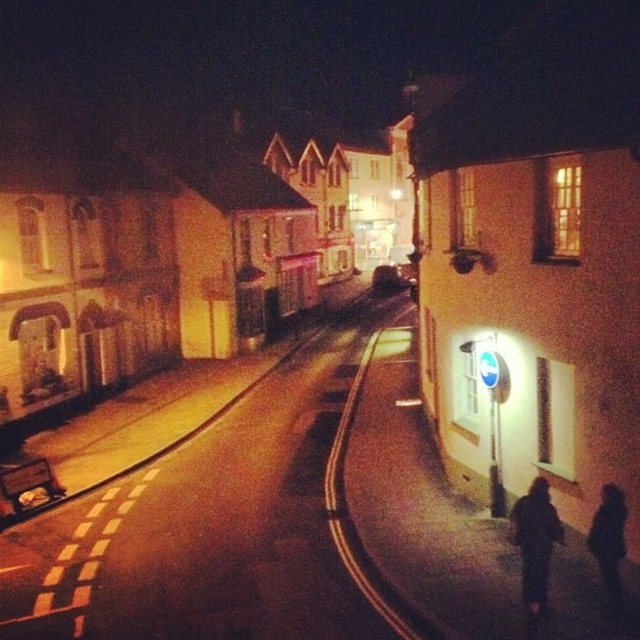
Does black asphalt road at center appear on the left side of black matte figure at lower right?

Indeed, black asphalt road at center is positioned on the left side of black matte figure at lower right.

Is point (32, 624) positioned after point (616, 550)?

Yes, it is behind point (616, 550).

The height and width of the screenshot is (640, 640). I want to click on black asphalt road at center, so click(x=209, y=524).

Image resolution: width=640 pixels, height=640 pixels. I want to click on black asphalt road at center, so click(209, 524).

Does dark fabric jacket at lower right appear over black matte figure at lower right?

No.

Does dark fabric jacket at lower right have a smaller size compared to black matte figure at lower right?

Indeed, dark fabric jacket at lower right has a smaller size compared to black matte figure at lower right.

I want to click on dark fabric jacket at lower right, so click(x=536, y=541).

Image resolution: width=640 pixels, height=640 pixels. I want to click on dark fabric jacket at lower right, so click(536, 541).

Who is lower down, black asphalt road at center or dark fabric jacket at lower right?

Positioned lower is black asphalt road at center.

This screenshot has width=640, height=640. Describe the element at coordinates (209, 524) in the screenshot. I see `black asphalt road at center` at that location.

The height and width of the screenshot is (640, 640). In order to click on black asphalt road at center in this screenshot , I will do `click(209, 524)`.